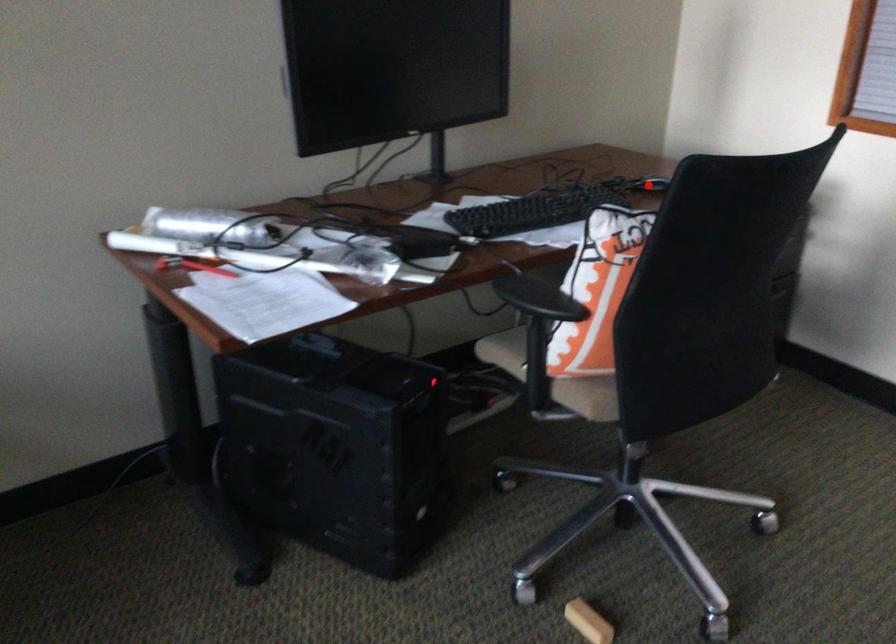
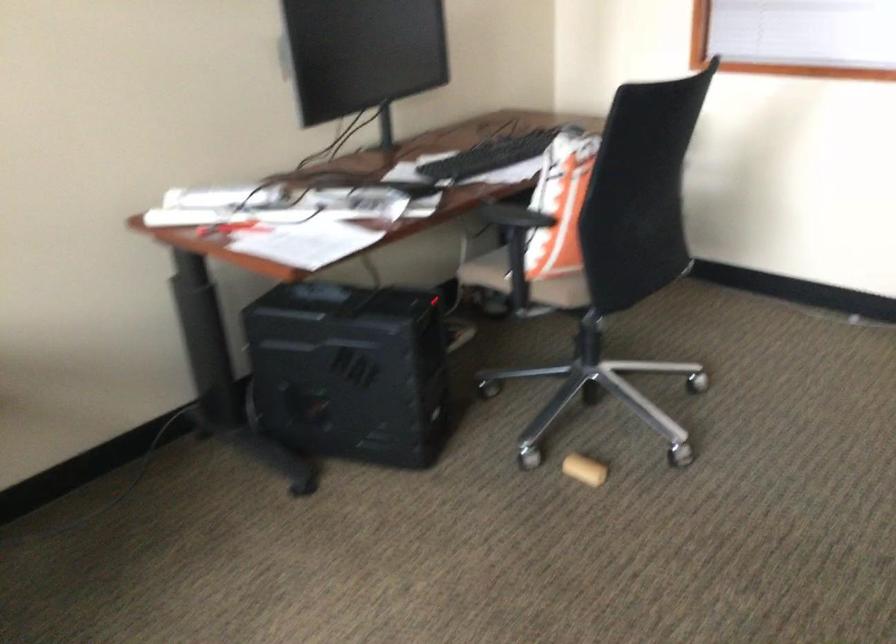
Question: I am providing you with two images of the same scene from different viewpoints. A red point is marked on the first image. At the location where the point appears in image 1, is it still visible in image 2?

Choices:
 (A) Yes
 (B) No

Answer: (B)